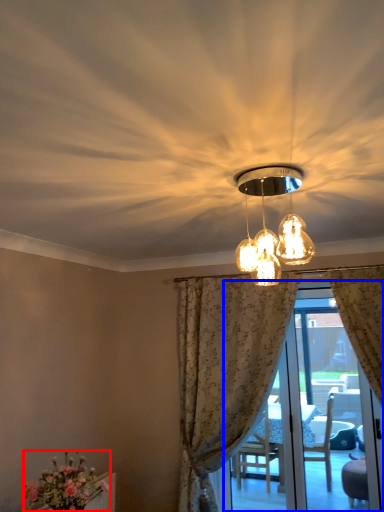
Question: Which of the following is the farthest to the observer, flower (highlighted by a red box) or screen door (highlighted by a blue box)?

Choices:
 (A) flower
 (B) screen door

Answer: (B)